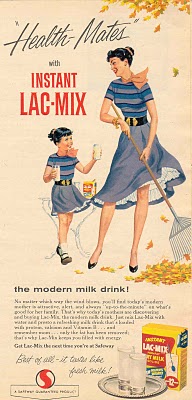
This screenshot has height=400, width=192. Find the location of `box`. box is located at coordinates (167, 344).